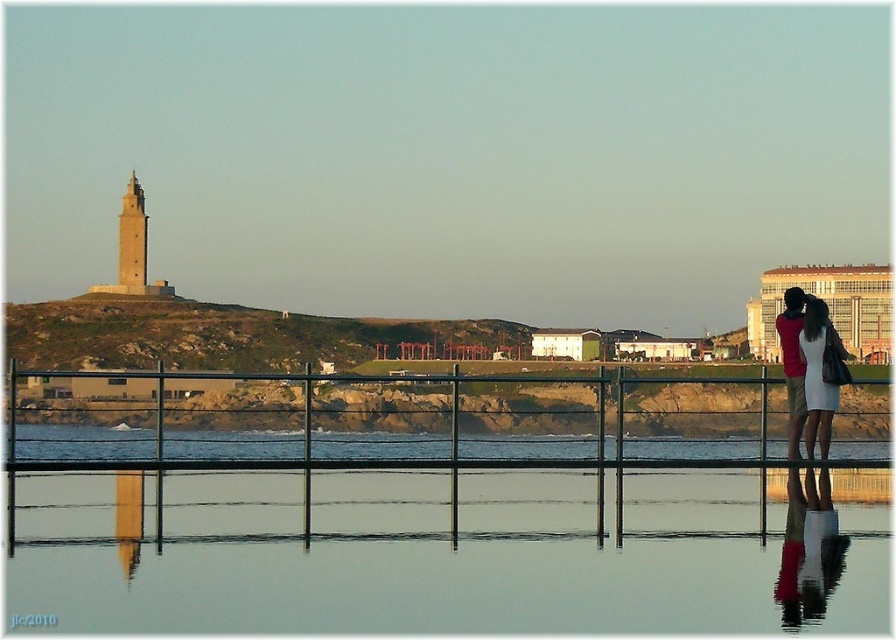
You are a photographer planning to capture the entire scene in one shot. Given that the metal fence at center and the brown stone tower at left are both in the frame, which object should you prioritize keeping within the camera frame to ensure the composition remains balanced?

The metal fence at center should be prioritized since its width is larger than the brown stone tower at left, making it a more dominant element in the composition.

You are standing at the edge of the water in the coastal scene. You want to walk towards the metal fence at center and the brown stone tower at left. Which one would you reach first if you walk straight ahead?

You would reach the metal fence at center first because it is positioned to the right of the brown stone tower at left, meaning it is closer to your current position at the water edge.

You are a photographer planning to take a sunset photo of the metal fence at center and the brown stone tower at left. Which object will appear taller in the photo?

Result: The brown stone tower at left will appear taller in the photo because it is taller than the metal fence at center.